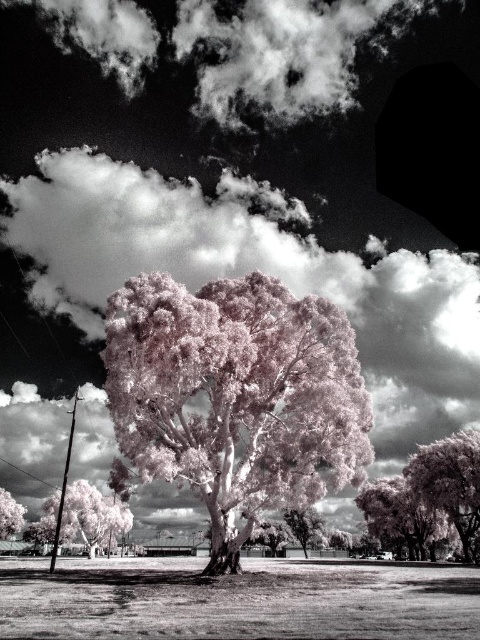
Based on the scene description, which object is taller when comparing the white fluffy cloud at upper center and the pink translucent tree at lower right?

The pink translucent tree at lower right is taller than the white fluffy cloud at upper center according to the description.

You are a drone operator who needs to fly a drone from the white fluffy cloud at upper center to the pink translucent tree at lower right. Given that your drone has a maximum flight range of 100 feet, can it reach the destination without recharging?

The distance between the white fluffy cloud at upper center and the pink translucent tree at lower right is 129.73 feet, which exceeds the drone operator s maximum flight range of 100 feet. Therefore, the drone cannot reach the destination without recharging.

You are an artist analyzing the composition of this infrared photograph. You notice the white fluffy cloud at upper center and the pink translucent tree at lower right. Which of these two elements is positioned to the left when comparing their locations?

The white fluffy cloud at upper center is positioned to the left of the pink translucent tree at lower right.